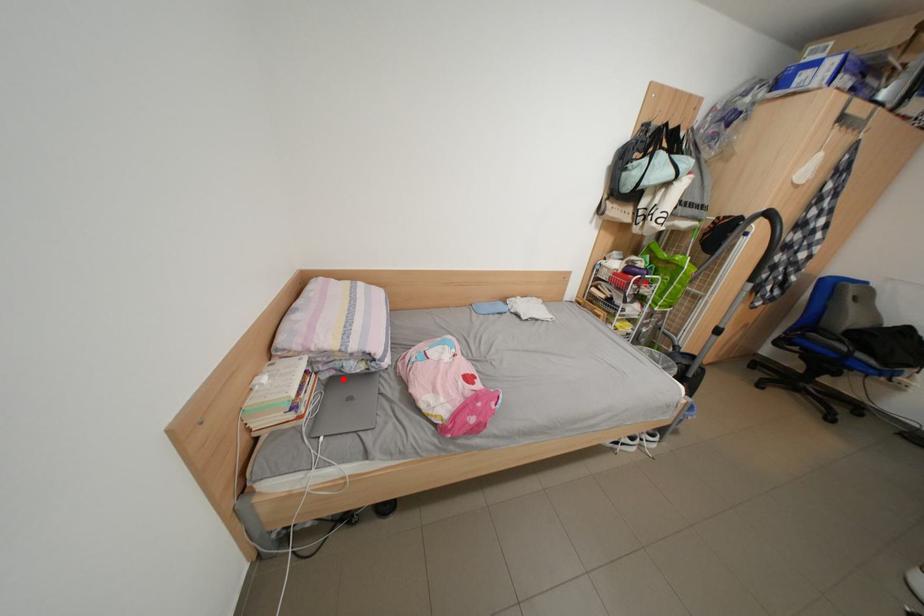
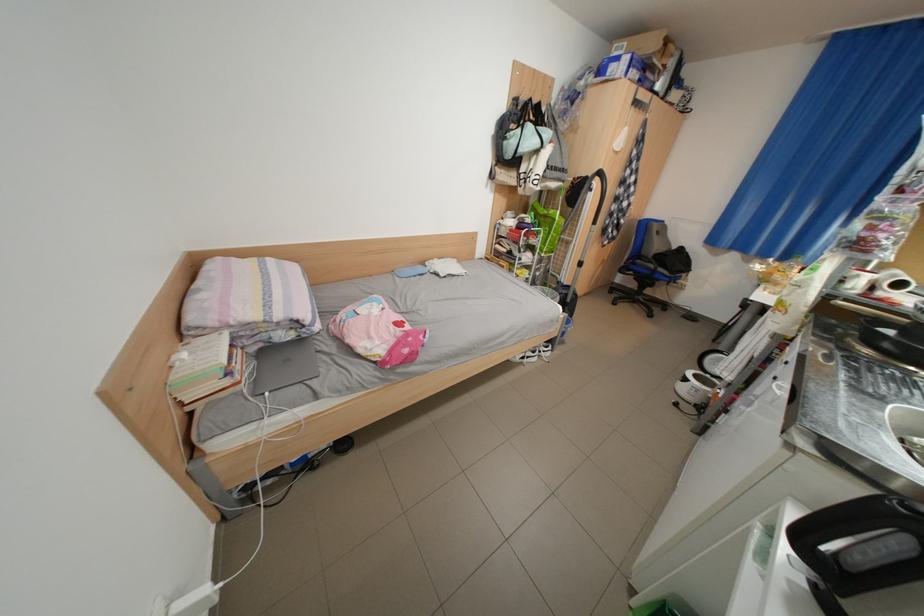
Find the pixel in the second image that matches the highlighted location in the first image.

(272, 351)